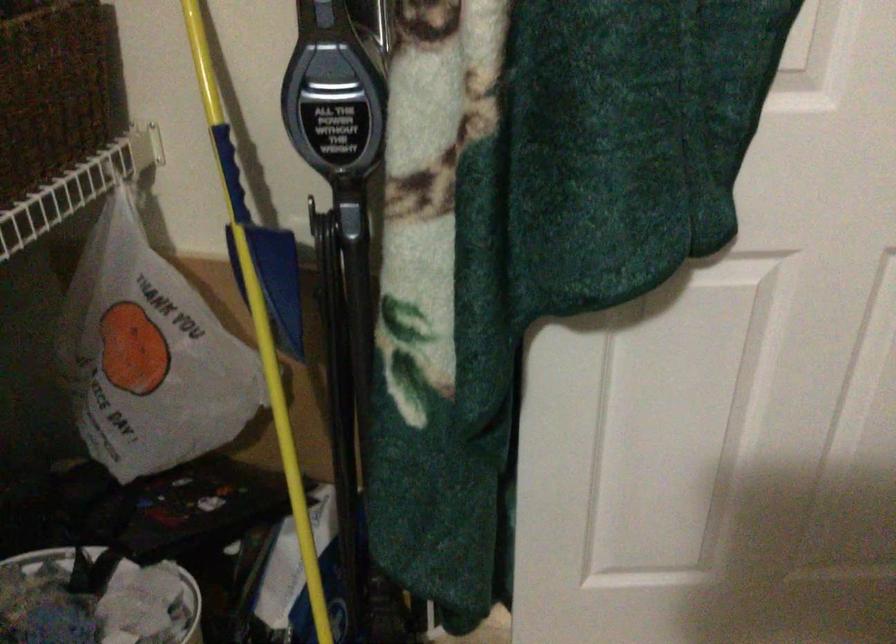
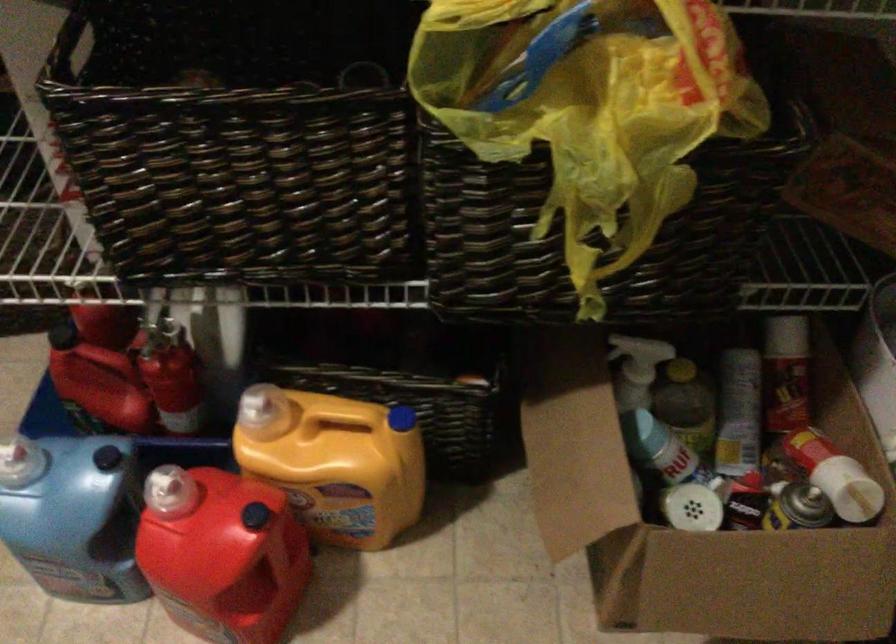
The first image is from the beginning of the video and the second image is from the end. How did the camera likely rotate when shooting the video?

The camera rotated toward left-down.